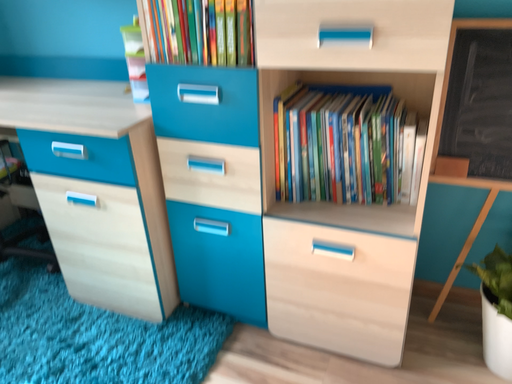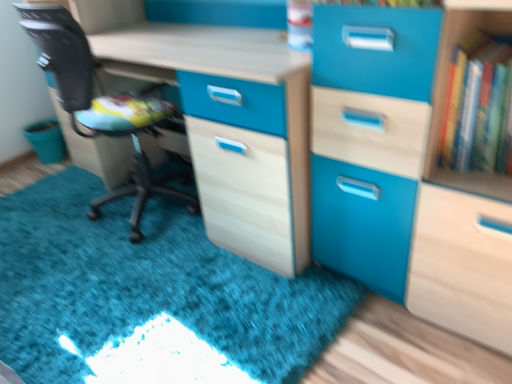
Question: Which way did the camera rotate in the video?

Choices:
 (A) rotated right
 (B) rotated left

Answer: (B)